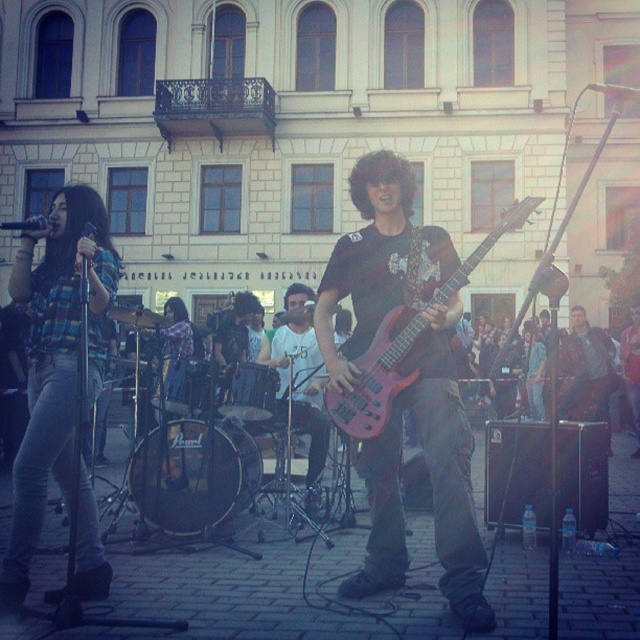
You are a photographer standing in the public square and want to take a photo of the plaid fabric shirt at left. You notice that the singer is moving slightly to the right. Based on the singer current position at point 0.566, 0.087, will the shirt still be in the frame if you pan your camera 0.1 units to the right?

The plaid fabric shirt at left is located at point [54,362]. Panning the camera 0.1 units to the right would move the frame to the right, but since the singer is moving to the right as well, the shirt should remain within the frame as both movements are in the same direction.

You are a photographer trying to capture the singer wearing the plaid fabric shirt at left. The camera you are using has a focus point at coordinate point (x=54, y=362). Will this focus point be effective for capturing the singer?

The plaid fabric shirt at left is located at point (x=54, y=362), so yes, the focus point at coordinate point (x=54, y=362) will be effective for capturing the singer wearing the plaid fabric shirt at left.

You are a photographer trying to capture the band members in the scene. You need to determine which object is narrower between the plaid fabric shirt at left and the shiny red electric guitar at center. Which one is narrower?

The plaid fabric shirt at left is narrower than the shiny red electric guitar at center.